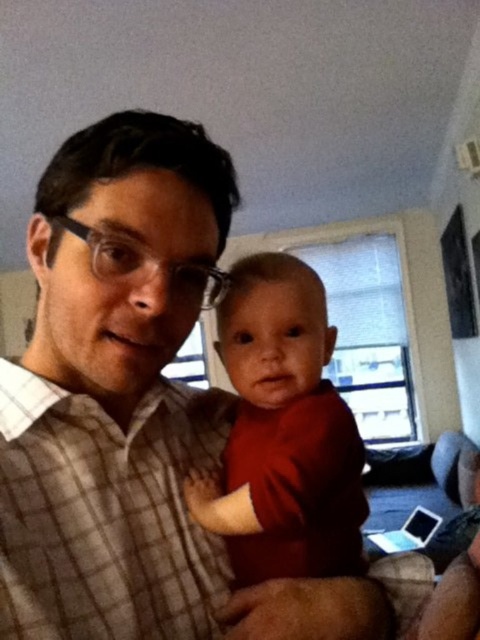
Is plaid shirt at center taller than matte red shirt at center?

Correct, plaid shirt at center is much taller as matte red shirt at center.

Can you confirm if plaid shirt at center is bigger than matte red shirt at center?

Yes, plaid shirt at center is bigger than matte red shirt at center.

What do you see at coordinates (132, 410) in the screenshot?
I see `plaid shirt at center` at bounding box center [132, 410].

Locate an element on the screen. plaid shirt at center is located at coordinates (132, 410).